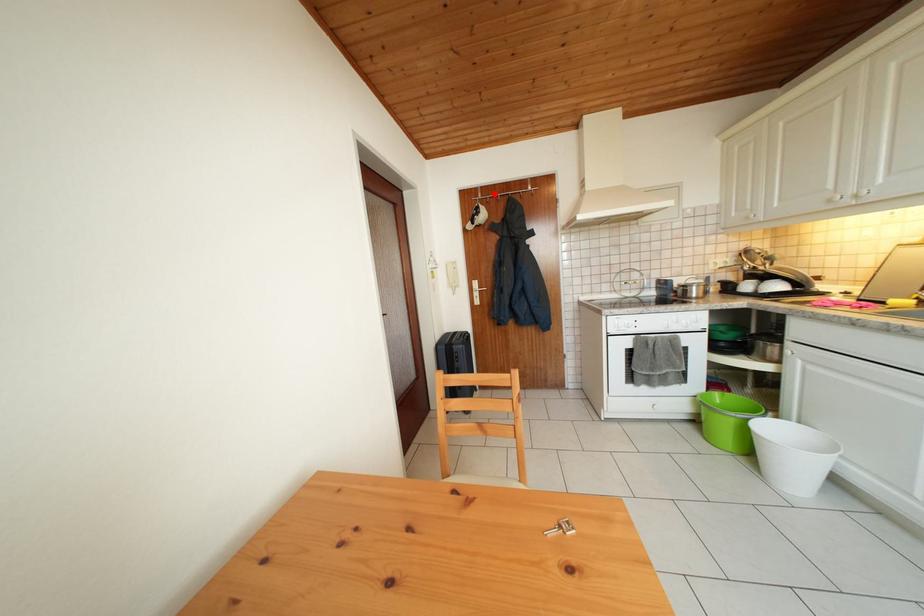
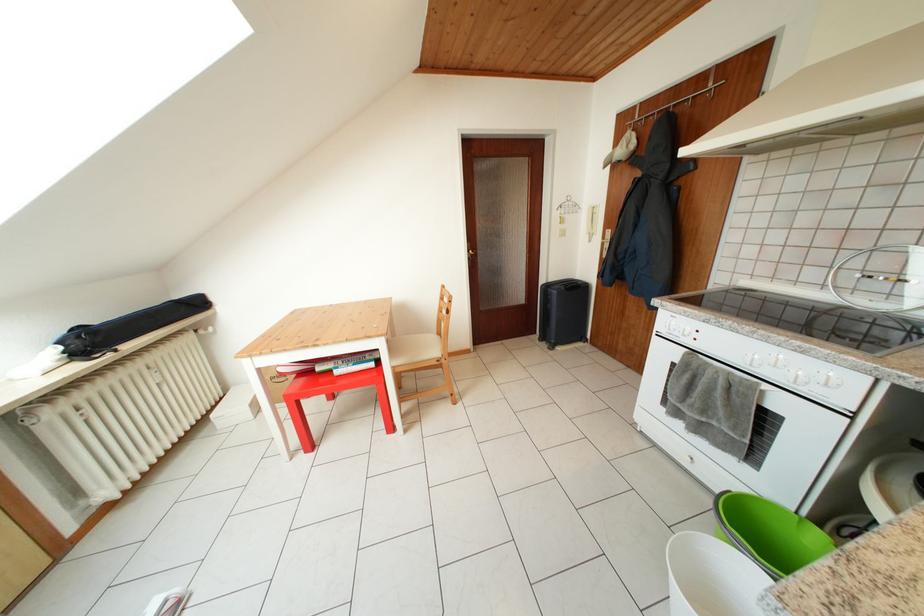
Question: I am providing you with two images of the same scene from different viewpoints. Given a red point in image1, look at the same physical point in image2. Is it:

Choices:
 (A) Closer to the viewpoint
 (B) Farther from the viewpoint

Answer: (B)